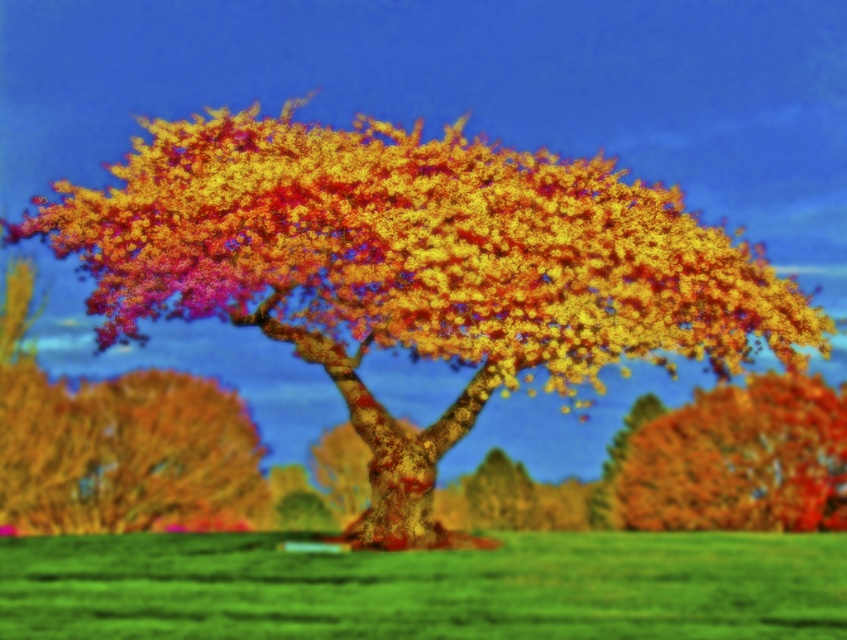
You are standing in the autumn scene and want to know which object at the center has a smaller width between the multicolored bark tree at center and the green grass at center. Which one is it?

The multicolored bark tree at center has a smaller width than the green grass at center.

You are standing in the autumnal scene and want to place a small bench. The bench needs to be placed under the tree but not directly under the trunk. Where should you place the bench in relation to the multicolored bark tree at center and the shiny multicolored leaves at center?

The bench should be placed under the shiny multicolored leaves at center since the multicolored bark tree at center is positioned over them, meaning the leaves are below the tree trunk area. This placement ensures the bench is under the tree but not directly under the trunk.